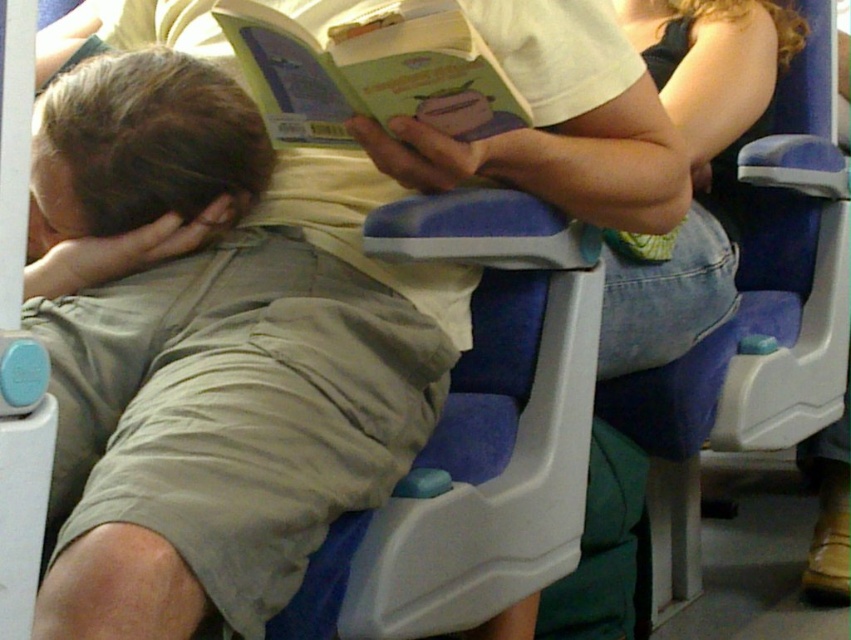
In the scene shown: You are a flight attendant checking the cabin and notice the brown matte hair at center and the green matte book at upper center. Which object takes up more space in the image?

The green matte book at upper center takes up more space in the image because it is larger than the brown matte hair at center.

You are standing in the public transportation setting and want to reach the point at coordinates point (216, 140). If you can extend your arm 36 inches forward, will you be able to reach it?

The point (216, 140) is 36.65 inches away from you, which is slightly beyond your arm extension of 36 inches. Therefore, you will not be able to reach it with your current arm extension.